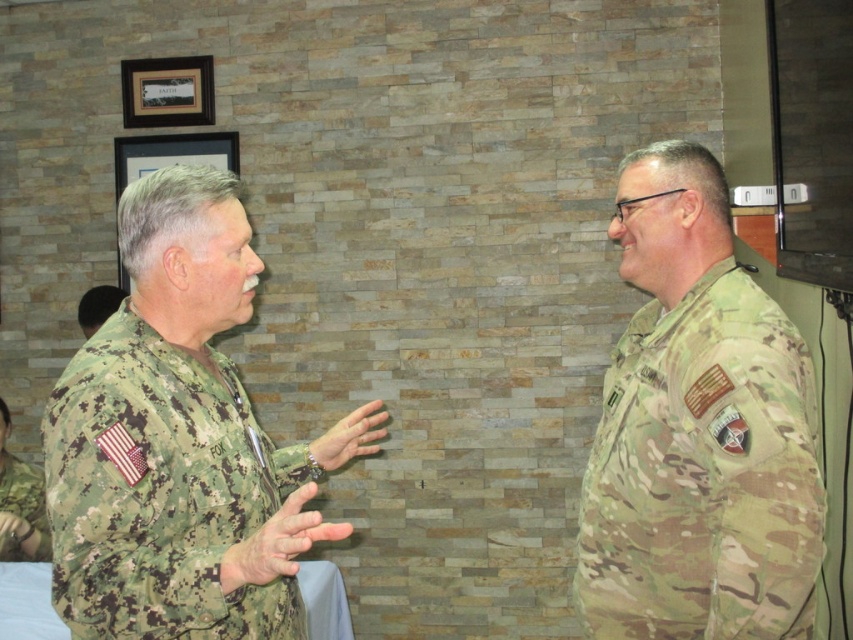
You are a photographer planning to take a group photo of the digital camouflage uniform at left and the camouflage uniform at center. Considering their heights, which uniform should be placed in the back row to ensure both are visible?

The digital camouflage uniform at left is much taller as camouflage uniform at center, so the digital camouflage uniform at left should be placed in the back row to ensure both are visible.

You are a photographer setting up for a group photo. You need to ensure that the digital camouflage uniform at left and the camouflage uniform at center are both visible in the frame. Based on their positions, which one might require more space to accommodate their width?

The digital camouflage uniform at left might require more space because it is wider than the camouflage uniform at center according to the description.